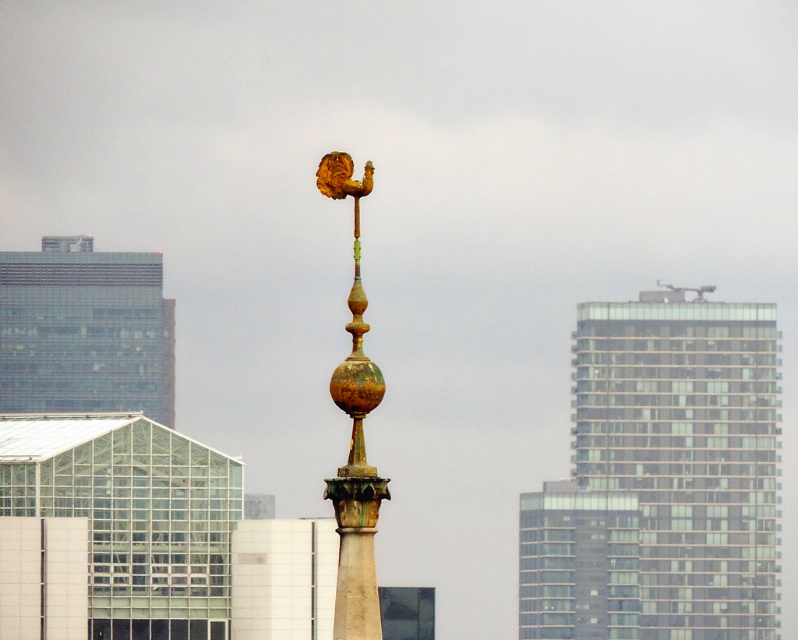
You are standing at a point 647.07 meters away from the point marked as point (551, 627) in the image of the weather vane. The weather vane is on top of a building surrounded by modern high rises. Can you estimate how far you are from the nearest high rise building in meters?

The distance from your position to the point marked (551, 627) is 647.07 meters. Since the weather vane is on top of a building surrounded by high rises, the nearest high rise building would likely be closer than 647.07 meters. However, without specific information about the exact positioning of the buildings, an exact distance cannot be determined. The answer is that the distance cannot be accurately estimated with the given information.